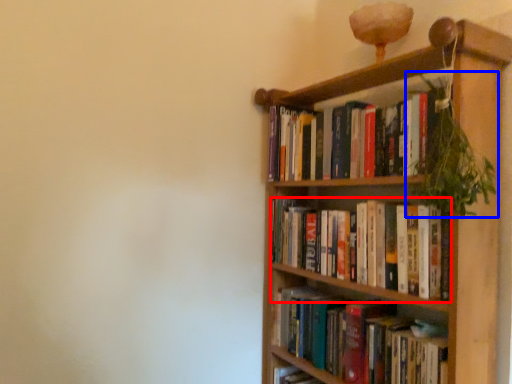
Question: Among these objects, which one is nearest to the camera, book (highlighted by a red box) or vegetation (highlighted by a blue box)?

Choices:
 (A) book
 (B) vegetation

Answer: (B)